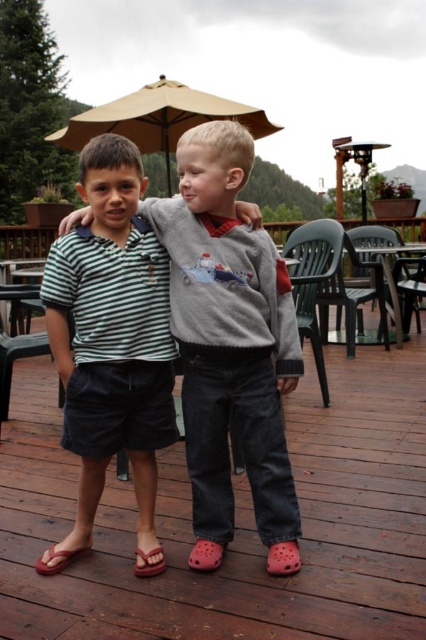
Question: Which is nearer to the red rubber flip-flop at lower left?

Choices:
 (A) croc shoe at lower right
 (B) pink rubber sandal at lower center

Answer: (B)

Question: Does wooden deck at center have a smaller size compared to green plastic chair at right?

Choices:
 (A) no
 (B) yes

Answer: (A)

Question: Can you confirm if beige fabric umbrella at upper center is wider than green plastic chair at right?

Choices:
 (A) yes
 (B) no

Answer: (A)

Question: Is black plastic chair at lower left in front of pink rubber sandal at lower center?

Choices:
 (A) no
 (B) yes

Answer: (A)

Question: Which point is farther to the camera?

Choices:
 (A) (281, 636)
 (B) (101, 112)

Answer: (B)

Question: Which is nearer to the striped cotton shirt at center?

Choices:
 (A) black plastic chair at lower left
 (B) red rubber flip-flop at lower left
 (C) green plastic chair at center
 (D) pink rubber sandal at lower center

Answer: (D)